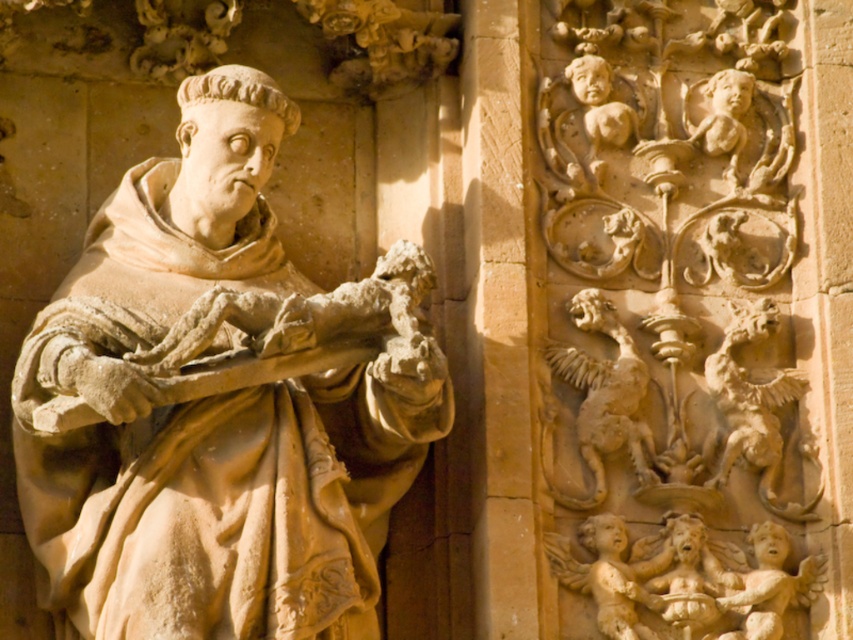
Is beige stone statue at center closer to the viewer compared to beige stone cherub at upper right?

Yes, it is in front of beige stone cherub at upper right.

Does beige stone statue at center have a lesser width compared to beige stone cherub at upper right?

No.

Where is `beige stone statue at center`? This screenshot has width=853, height=640. beige stone statue at center is located at coordinates tap(207, 416).

Between smooth beige cherub at right and smooth stone cherub at lower right, which one appears on the right side from the viewer's perspective?

smooth stone cherub at lower right is more to the right.

Can you confirm if smooth beige cherub at right is smaller than smooth stone cherub at lower right?

Actually, smooth beige cherub at right might be larger than smooth stone cherub at lower right.

Where is `smooth beige cherub at right`? This screenshot has height=640, width=853. smooth beige cherub at right is located at coordinates (610, 573).

Between carved stone lion at upper right and smooth beige cherub at right, which one has more height?

With more height is smooth beige cherub at right.

Consider the image. Does carved stone lion at upper right appear on the left side of smooth beige cherub at right?

No, carved stone lion at upper right is not to the left of smooth beige cherub at right.

Which is in front, point (796, 396) or point (630, 600)?

Point (630, 600) is in front.

The height and width of the screenshot is (640, 853). Find the location of `carved stone lion at upper right`. carved stone lion at upper right is located at coordinates (753, 404).